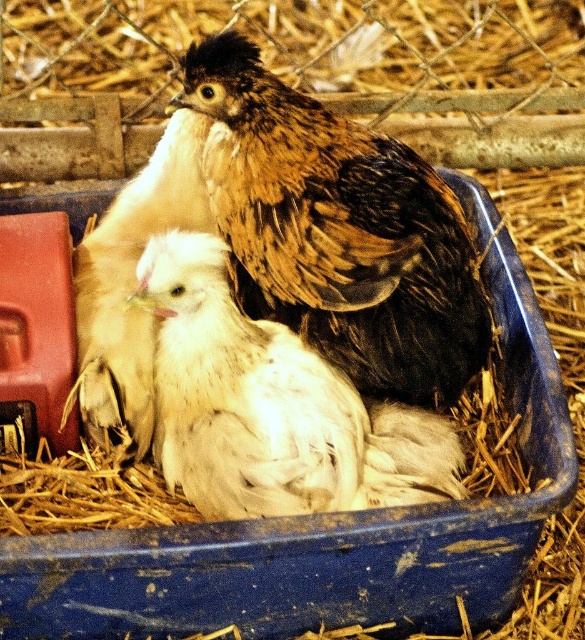
Does brown feathered chicken at center have a lesser width compared to white fluffy chicken at center?

In fact, brown feathered chicken at center might be wider than white fluffy chicken at center.

Between brown feathered chicken at center and white fluffy chicken at center, which one is positioned lower?

white fluffy chicken at center is lower down.

Locate an element on the screen. Image resolution: width=585 pixels, height=640 pixels. brown feathered chicken at center is located at coordinates (338, 230).

Identify the location of brown feathered chicken at center. (338, 230).

Does brown feathered chicken at center come behind white fluffy chick at center?

Yes, it is behind white fluffy chick at center.

Is point (319, 333) positioned behind point (153, 248)?

Yes, point (319, 333) is farther from viewer.

Is point (215, 102) in front of point (252, 465)?

No, it is not.

The width and height of the screenshot is (585, 640). I want to click on brown feathered chicken at center, so click(x=338, y=230).

Between white fluffy chick at center and white fluffy chicken at center, which one is positioned higher?

white fluffy chicken at center is higher up.

Is white fluffy chick at center smaller than white fluffy chicken at center?

Yes.

What do you see at coordinates (270, 406) in the screenshot? The height and width of the screenshot is (640, 585). I see `white fluffy chick at center` at bounding box center [270, 406].

You are a GUI agent. You are given a task and a screenshot of the screen. Output one action in this format:
    pyautogui.click(x=<x>, y=<y>)
    Task: Click on the white fluffy chick at center
    The width and height of the screenshot is (585, 640).
    Given the screenshot: What is the action you would take?
    pos(270,406)